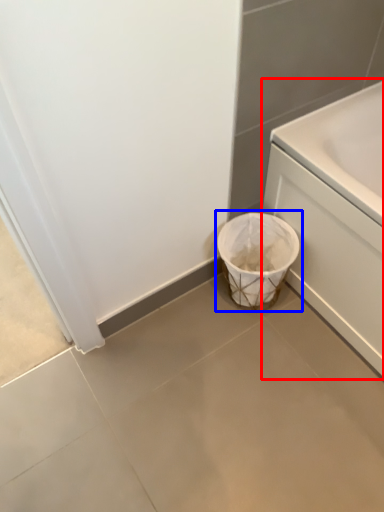
Question: Which of the following is the farthest to the observer, bath (highlighted by a red box) or waste container (highlighted by a blue box)?

Choices:
 (A) bath
 (B) waste container

Answer: (B)